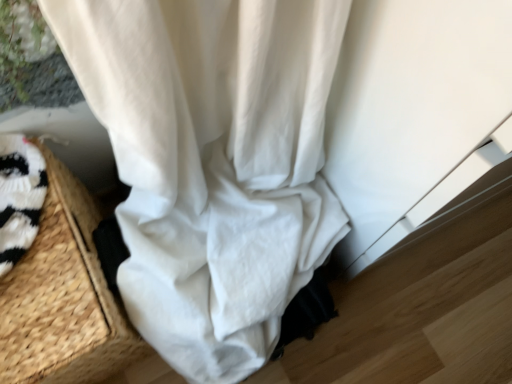
What is the approximate height of woven straw basket at lower left?

15.49 inches.

Describe the element at coordinates (63, 297) in the screenshot. I see `woven straw basket at lower left` at that location.

Find the location of `woven straw basket at lower left`. woven straw basket at lower left is located at coordinates (63, 297).

Locate an element on the screen. This screenshot has width=512, height=384. white cotton curtain at center is located at coordinates (212, 163).

This screenshot has height=384, width=512. Describe the element at coordinates (212, 163) in the screenshot. I see `white cotton curtain at center` at that location.

You are a GUI agent. You are given a task and a screenshot of the screen. Output one action in this format:
    pyautogui.click(x=<x>, y=<y>)
    Task: Click on the woven straw basket at lower left
    Image resolution: width=512 pixels, height=384 pixels.
    Given the screenshot: What is the action you would take?
    pyautogui.click(x=63, y=297)

Which is more to the left, woven straw basket at lower left or white cotton curtain at center?

From the viewer's perspective, woven straw basket at lower left appears more on the left side.

Considering the positions of objects woven straw basket at lower left and white cotton curtain at center in the image provided, who is behind, woven straw basket at lower left or white cotton curtain at center?

white cotton curtain at center is further away from the camera.

Which is closer, (44, 260) or (310, 23)?

Clearly, point (44, 260) is more distant from the camera than point (310, 23).

From the image's perspective, between woven straw basket at lower left and white cotton curtain at center, who is located below?

From the image's view, woven straw basket at lower left is below.

From a real-world perspective, is woven straw basket at lower left physically above white cotton curtain at center?

Indeed, from a real-world perspective, woven straw basket at lower left stands above white cotton curtain at center.

Considering the relative sizes of woven straw basket at lower left and white cotton curtain at center in the image provided, is woven straw basket at lower left wider than white cotton curtain at center?

No.

Considering the sizes of objects woven straw basket at lower left and white cotton curtain at center in the image provided, who is taller, woven straw basket at lower left or white cotton curtain at center?

woven straw basket at lower left.

Which of these two, woven straw basket at lower left or white cotton curtain at center, is bigger?

With larger size is woven straw basket at lower left.

Would you say woven straw basket at lower left is outside white cotton curtain at center?

That's correct, woven straw basket at lower left is outside of white cotton curtain at center.

Is woven straw basket at lower left beside white cotton curtain at center?

No, woven straw basket at lower left is not with white cotton curtain at center.

Is woven straw basket at lower left looking in the opposite direction of white cotton curtain at center?

No, woven straw basket at lower left is not facing the opposite direction of white cotton curtain at center.

How many degrees apart are the facing directions of woven straw basket at lower left and white cotton curtain at center?

The facing directions of woven straw basket at lower left and white cotton curtain at center are 7.91e-05 degrees apart.

How far apart are woven straw basket at lower left and white cotton curtain at center?

woven straw basket at lower left and white cotton curtain at center are 8.94 inches apart.

Where is `curtain above the woven straw basket at lower left (from the image's perspective)`? The image size is (512, 384). curtain above the woven straw basket at lower left (from the image's perspective) is located at coordinates (212, 163).

Which is more to the right, white cotton curtain at center or woven straw basket at lower left?

white cotton curtain at center is more to the right.

Relative to woven straw basket at lower left, is white cotton curtain at center in front or behind?

Visually, white cotton curtain at center is located behind woven straw basket at lower left.

Is point (246, 294) closer or farther from the camera than point (91, 289)?

Point (246, 294).

Based on the photo, from the image's perspective, which object appears higher, white cotton curtain at center or woven straw basket at lower left?

white cotton curtain at center appears higher in the image.

From a real-world perspective, between white cotton curtain at center and woven straw basket at lower left, who is vertically lower?

white cotton curtain at center.

Does white cotton curtain at center have a greater width compared to woven straw basket at lower left?

Indeed, white cotton curtain at center has a greater width compared to woven straw basket at lower left.

From the picture: Between white cotton curtain at center and woven straw basket at lower left, which one has more height?

woven straw basket at lower left.

Considering the relative sizes of white cotton curtain at center and woven straw basket at lower left in the image provided, is white cotton curtain at center bigger than woven straw basket at lower left?

Actually, white cotton curtain at center might be smaller than woven straw basket at lower left.

Is white cotton curtain at center not inside woven straw basket at lower left?

Yes.

Is white cotton curtain at center far away from woven straw basket at lower left?

No, white cotton curtain at center is not far from woven straw basket at lower left.

Is white cotton curtain at center looking in the opposite direction of woven straw basket at lower left?

No, woven straw basket at lower left is not at the back of white cotton curtain at center.

How different are the orientations of white cotton curtain at center and woven straw basket at lower left in degrees?

There is a 7.91e-05-degree angle between the facing directions of white cotton curtain at center and woven straw basket at lower left.

What are the coordinates of `basket that appears in front of the white cotton curtain at center` in the screenshot? It's located at (63, 297).

What are the coordinates of `curtain that is behind the woven straw basket at lower left` in the screenshot? It's located at (212, 163).

Find the location of a particular element. Image resolution: width=512 pixels, height=384 pixels. curtain above the woven straw basket at lower left (from the image's perspective) is located at coordinates (212, 163).